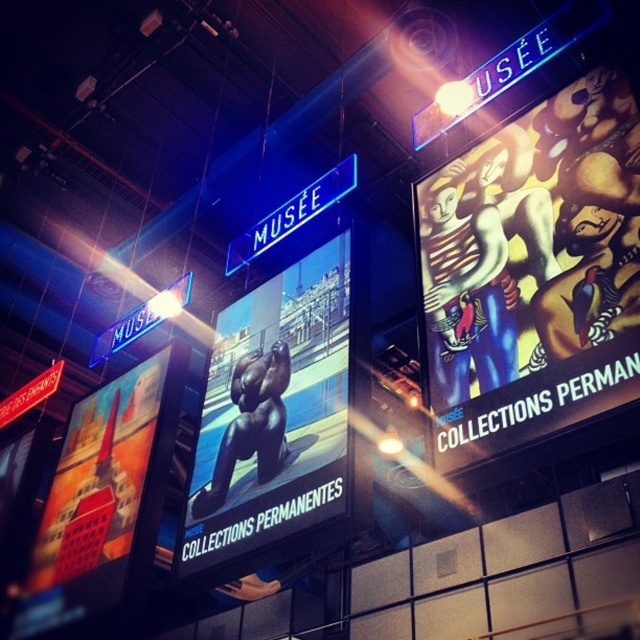
Question: Which of the following is the closest to the observer?

Choices:
 (A) black glossy bear at center
 (B) shiny black bear at left

Answer: (B)

Question: Which is nearer to the shiny black bear at left?

Choices:
 (A) black glossy bear at center
 (B) matte colorful painting at upper right

Answer: (A)

Question: Is black glossy bear at center further to the viewer compared to shiny black bear at left?

Choices:
 (A) no
 (B) yes

Answer: (B)

Question: Which object is positioned farthest from the shiny black bear at left?

Choices:
 (A) black glossy bear at center
 (B) matte colorful painting at upper right

Answer: (B)

Question: Can you confirm if matte colorful painting at upper right is thinner than black glossy bear at center?

Choices:
 (A) yes
 (B) no

Answer: (B)

Question: Does matte colorful painting at upper right have a lesser width compared to shiny black bear at left?

Choices:
 (A) no
 (B) yes

Answer: (A)